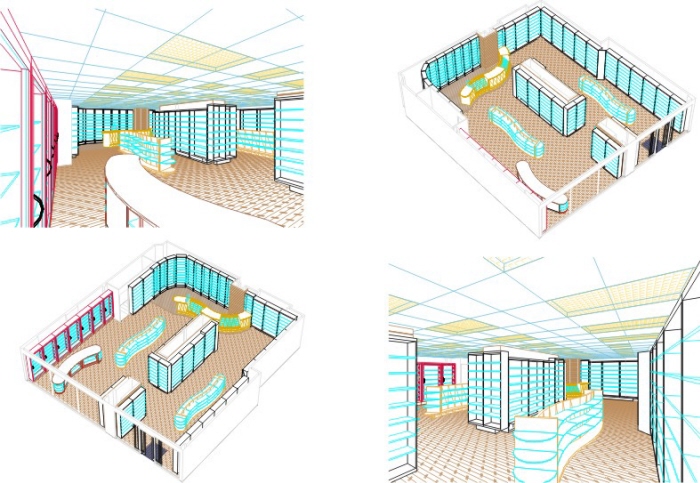
This screenshot has height=483, width=700. Identify the location of ceiling panel. (112, 25).